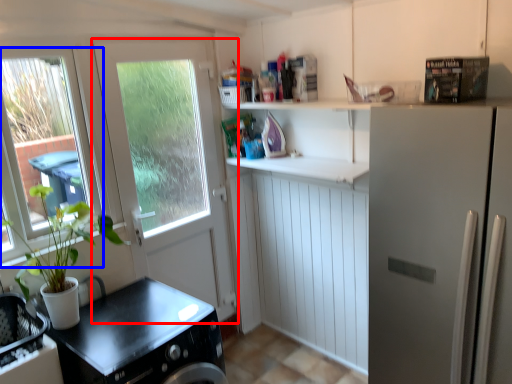
Question: Which point is closer to the camera, door (highlighted by a red box) or window (highlighted by a blue box)?

Choices:
 (A) door
 (B) window

Answer: (B)